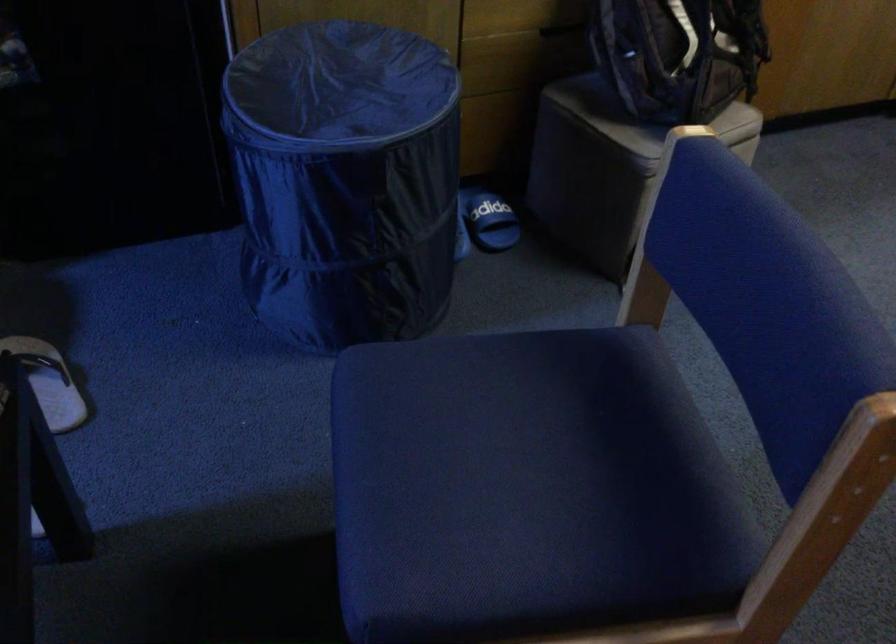
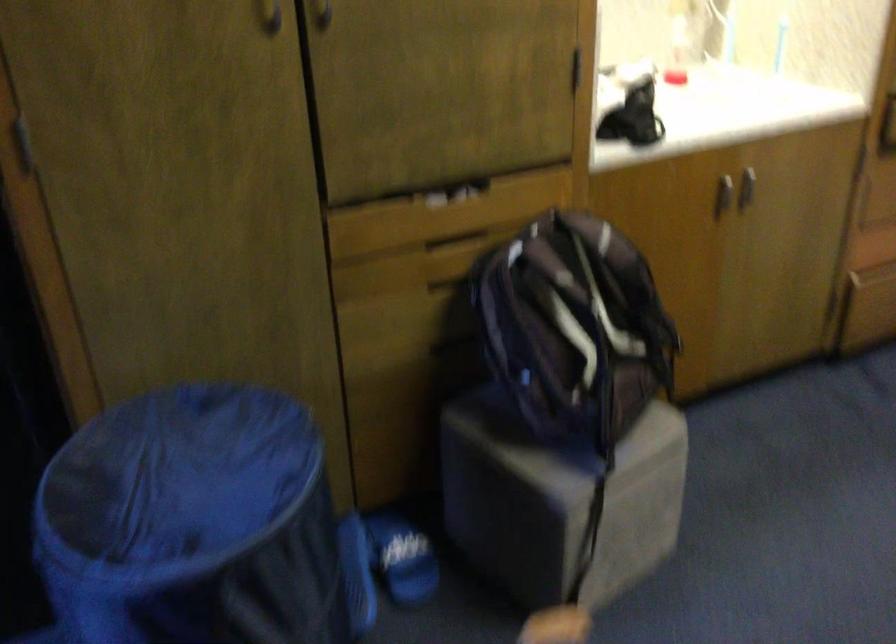
Where in the second image is the point corresponding to (x=349, y=120) from the first image?

(193, 523)